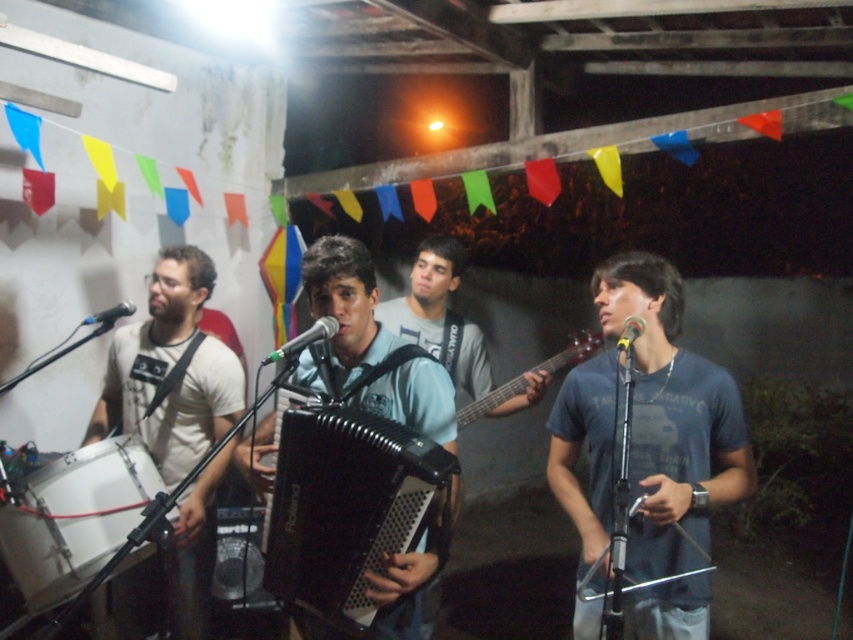
You are a photographer trying to capture the band members in the image. You want to ensure that both the white drum at lower left and the metallic silver guitar at center are clearly visible in your shot. Based on their positions, which instrument should you focus on first to ensure it appears sharp in the photo?

The white drum at lower left is in front of the metallic silver guitar at center, so you should focus on the white drum at lower left first to ensure it appears sharp. Since it is closer to the camera, focusing on it will keep it in clear focus while the guitar might be slightly blurred if the depth of field is shallow.

You are a photographer setting up equipment for the band. You need to position a tall tripod to capture both the white drum at lower left and the matte black accordion at center. Which object will require the tripod to be placed closer to the camera to ensure it is fully in frame?

The white drum at lower left is shorter than the matte black accordion at center, so the tripod should be placed closer to the camera to ensure the shorter white drum at lower left is fully captured in the frame.

You are a stagehand setting up a new microphone stand that requires 5 feet of space between the white drum at lower left and matte black accordion at center. Based on the current setup, can the microphone stand be placed between them?

The distance between the white drum at lower left and matte black accordion at center is 4.52 feet, which is less than the required 5 feet. Therefore, the microphone stand cannot be placed between them with the necessary space.